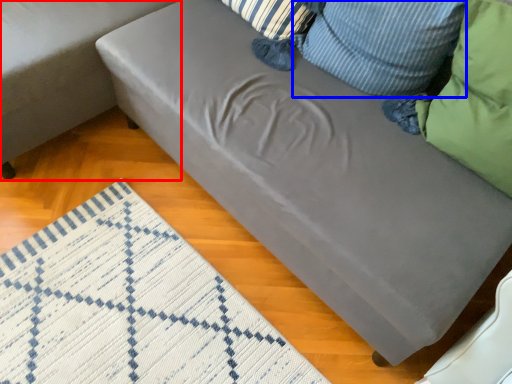
Question: Which point is closer to the camera, studio couch (highlighted by a red box) or pillow (highlighted by a blue box)?

Choices:
 (A) studio couch
 (B) pillow

Answer: (B)